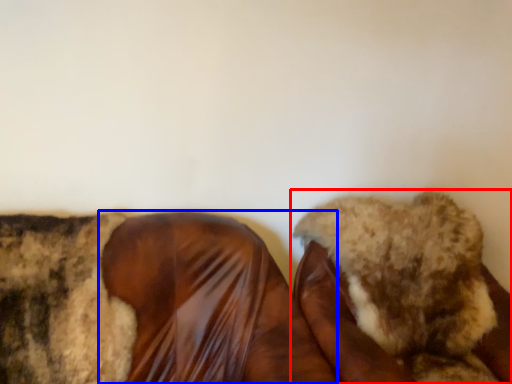
Question: Which object is further to the camera taking this photo, footwear (highlighted by a red box) or footwear (highlighted by a blue box)?

Choices:
 (A) footwear
 (B) footwear

Answer: (A)